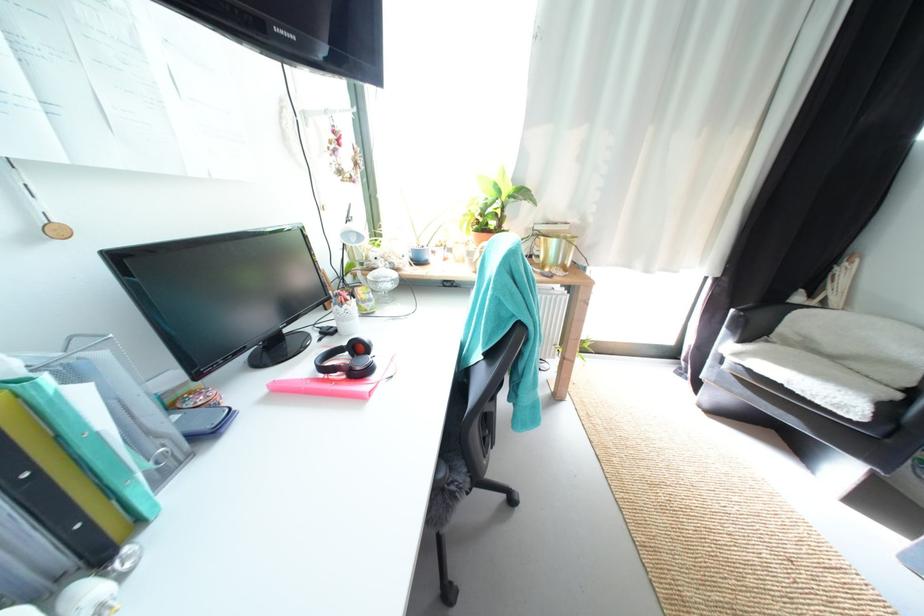
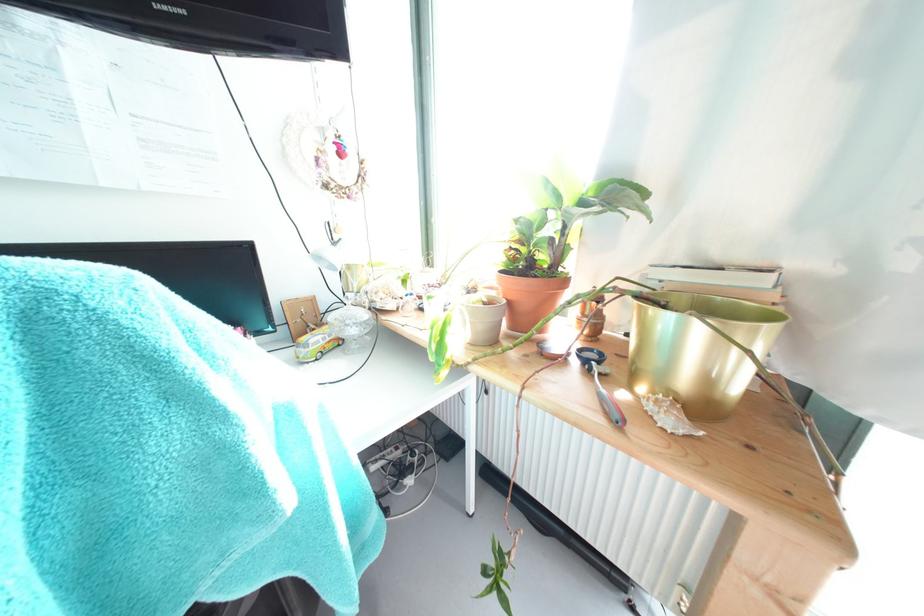
In the second image, find the point that corresponds to point 562,244 in the first image.

(675, 321)